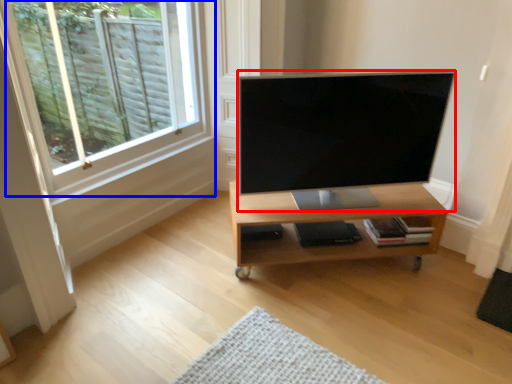
Question: Which of the following is the farthest to the observer, television (highlighted by a red box) or window (highlighted by a blue box)?

Choices:
 (A) television
 (B) window

Answer: (A)